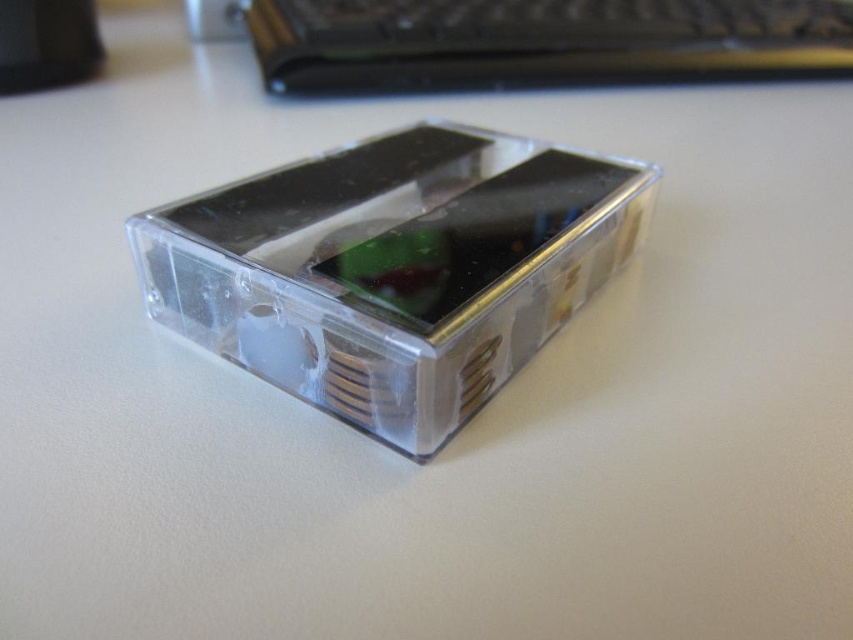
Between transparent plastic smartphone at center and clear plastic computer at center, which one has less height?

clear plastic computer at center is shorter.

Is transparent plastic smartphone at center taller than clear plastic computer at center?

Indeed, transparent plastic smartphone at center has a greater height compared to clear plastic computer at center.

Measure the distance between point (x=627, y=202) and camera.

They are 4.54 feet apart.

At what (x,y) coordinates should I click in order to perform the action: click on transparent plastic smartphone at center. Please return your answer as a coordinate pair (x, y). Looking at the image, I should click on (393, 269).